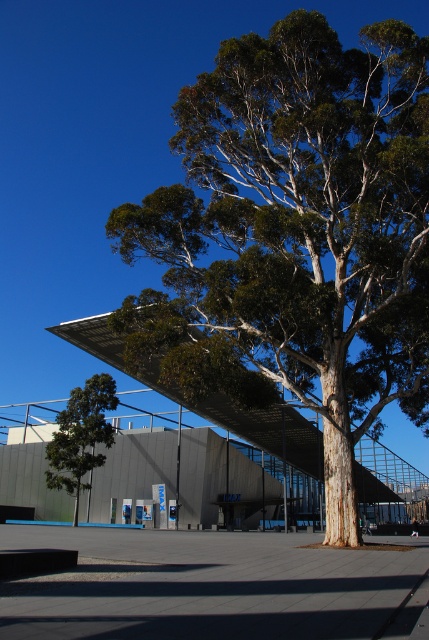
You are standing in front of the modern building and want to take a photo that includes both the green leafy tree at center and the green leafy tree at left. Which tree should you position closer to the camera to ensure both are in focus?

To ensure both the green leafy tree at center and the green leafy tree at left are in focus, you should position the green leafy tree at center closer to the camera since it is already closer to the viewer than the green leafy tree at left. This way, the distance between them will be minimized, allowing for better depth of field.

Looking at this image, you are standing in front of the modern architectural structure and want to take a photo of the IMAX sign without the green leafy tree at center blocking the view. Based on the coordinates provided, can you position yourself to the left or right of the tree to achieve this?

The green leafy tree at center is located at coordinates point (295, 234). To avoid blocking the view of the IMAX sign, you should position yourself to the right of the green leafy tree at center.